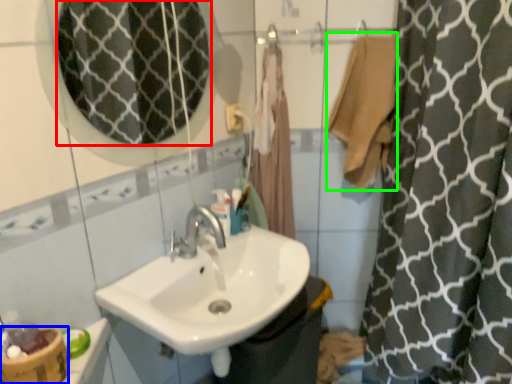
Question: Based on their relative distances, which object is farther from mirror (highlighted by a red box)? Choose from basket (highlighted by a blue box) and bath towel (highlighted by a green box).

Choices:
 (A) basket
 (B) bath towel

Answer: (A)